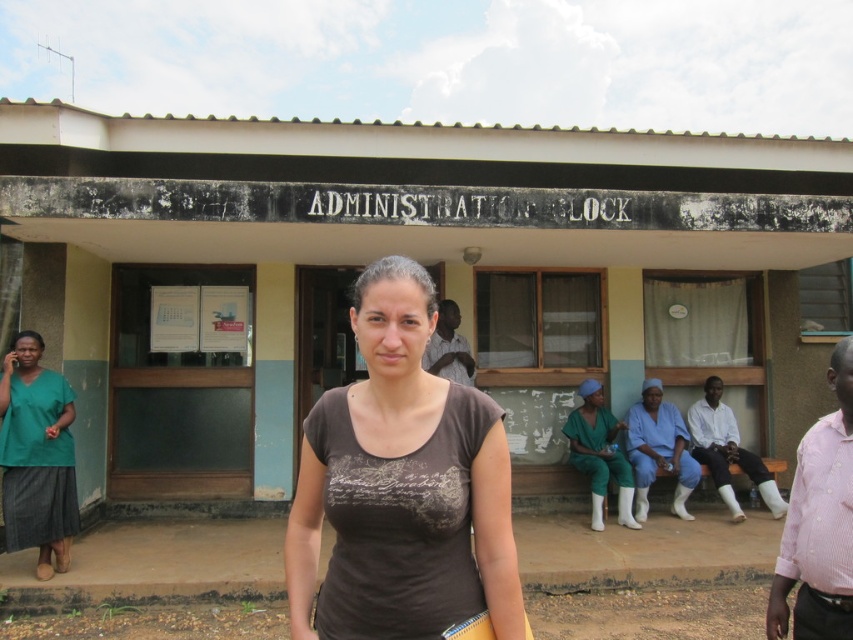
You are a photographer setting up a tripod in front of the ADMINISTRATION BLOCK. You notice two people in the foreground wearing the matte green scrubs at center and the gray fabric shirt at center. Which clothing item should you adjust your camera focus on if you want to ensure the wider one is in sharp detail?

The matte green scrubs at center might be wider than gray fabric shirt at center, so you should focus on the matte green scrubs at center to ensure the wider one is in sharp detail.

You are standing at the point labeled point (x=3, y=449) and want to walk to the point labeled point (x=595, y=474). Is the destination point behind you or in front of you?

The destination point labeled point (x=595, y=474) is behind you because the starting point labeled point (x=3, y=449) is in front of it.